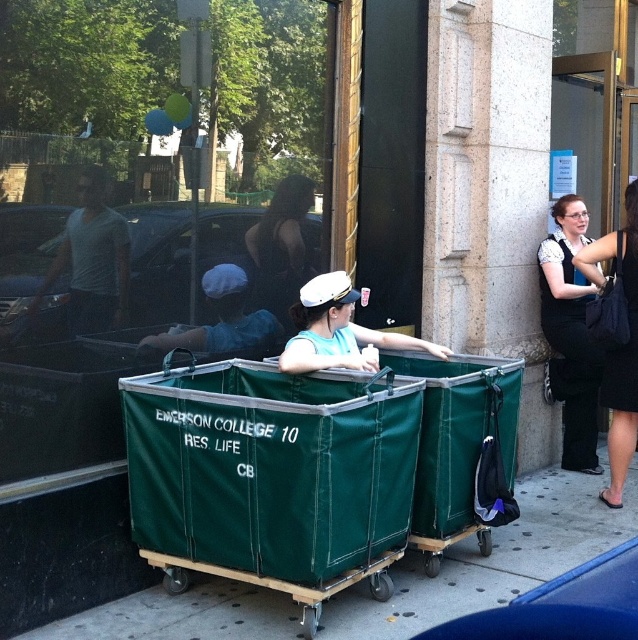
Does point (396, 625) come behind point (175, 346)?

No, it is in front of (175, 346).

Who is positioned more to the left, green fabric cart at center or blue fabric cart at center?

blue fabric cart at center

Between point (530, 493) and point (197, 332), which one is positioned in front?

Positioned in front is point (197, 332).

Find the location of a particular element. green fabric cart at center is located at coordinates (493, 560).

Who is more forward, (293, 372) or (218, 284)?

Point (293, 372) is in front.

Does point (334, 294) come closer to viewer compared to point (219, 340)?

Yes, point (334, 294) is closer to viewer.

Which is behind, point (350, 328) or point (211, 340)?

Positioned behind is point (350, 328).

The width and height of the screenshot is (638, 640). I want to click on white matte cap at center, so click(338, 330).

Can you confirm if black fabric dress at right is bigger than blue fabric cart at center?

Yes.

Who is higher up, black fabric dress at right or blue fabric cart at center?

blue fabric cart at center

The height and width of the screenshot is (640, 638). I want to click on black fabric dress at right, so click(x=570, y=333).

What are the coordinates of `black fabric dress at right` in the screenshot? It's located at (570, 333).